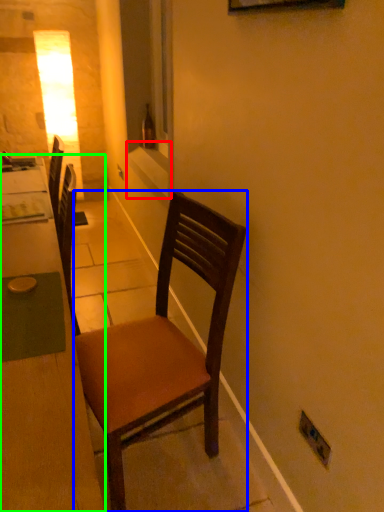
Question: Based on their relative distances, which object is nearer to window sill (highlighted by a red box)? Choose from chair (highlighted by a blue box) and desk (highlighted by a green box).

Choices:
 (A) chair
 (B) desk

Answer: (B)